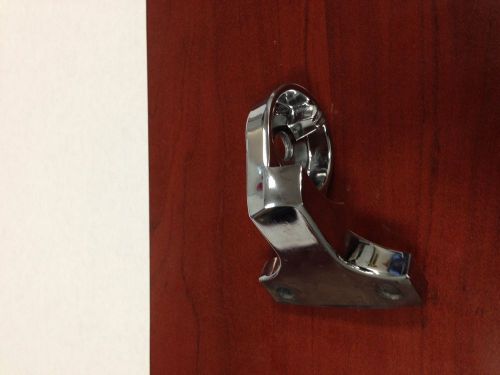
At what (x,y) coordinates should I click in order to perform the action: click on hinge. Please return your answer as a coordinate pair (x, y). The width and height of the screenshot is (500, 375). Looking at the image, I should click on (277, 220).